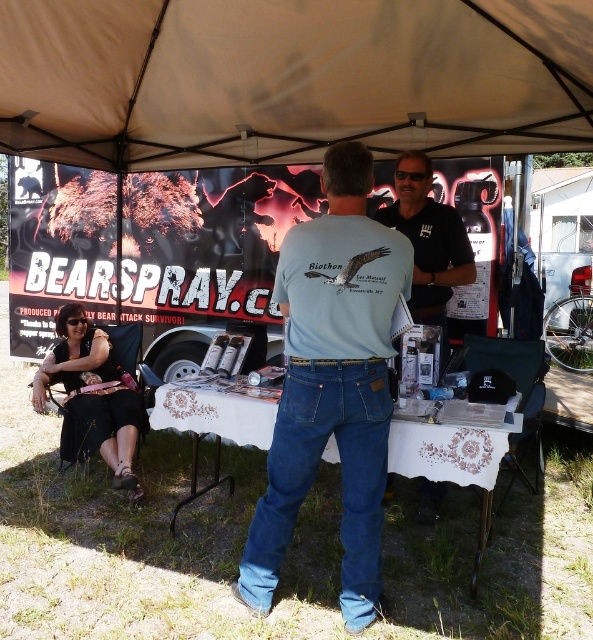
You are standing at the event booth and want to know which of the two points, point (x=144, y=113) or point (x=416, y=237), is closer to you. Can you determine this based on their positions?

Point (x=144, y=113) is closer to you because it is further to the camera than point (x=416, y=237).